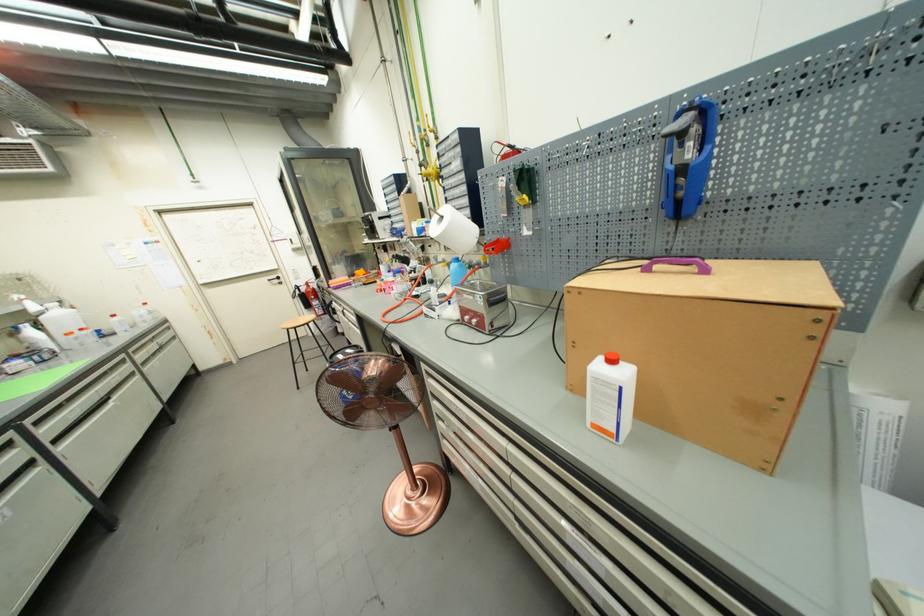
The width and height of the screenshot is (924, 616). In order to click on red machine knob in this screenshot , I will do (496, 246).